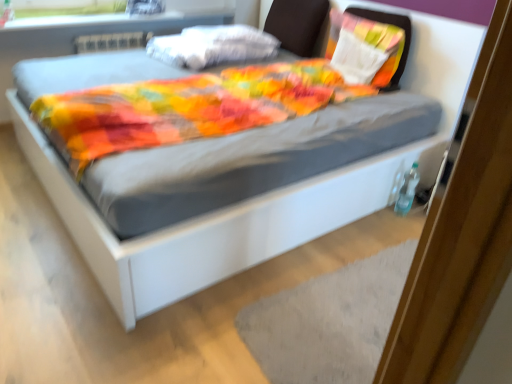
This screenshot has height=384, width=512. Identify the location of matte plastic window sill at upper left. (125, 21).

Image resolution: width=512 pixels, height=384 pixels. I want to click on white cotton pillow at upper center, which ranks as the second pillow in right-to-left order, so click(212, 46).

You are a GUI agent. You are given a task and a screenshot of the screen. Output one action in this format:
    pyautogui.click(x=<x>, y=<y>)
    Task: Click on the textured fabric pillow at upper right, marked as the second pillow in a left-to-right arrangement
    
    Given the screenshot: What is the action you would take?
    pyautogui.click(x=370, y=41)

Considering the positions of points (196, 44) and (315, 38), is point (196, 44) farther from camera compared to point (315, 38)?

No, it is in front of (315, 38).

Considering the sizes of white cotton pillow at upper center, which is the first pillow in left-to-right order, and brown fabric headboard at upper center in the image, is white cotton pillow at upper center, which is the first pillow in left-to-right order, taller or shorter than brown fabric headboard at upper center?

Considering their sizes, white cotton pillow at upper center, which is the first pillow in left-to-right order, has less height than brown fabric headboard at upper center.

Is white cotton pillow at upper center, which is the first pillow in left-to-right order, inside or outside of brown fabric headboard at upper center?

white cotton pillow at upper center, which is the first pillow in left-to-right order, is spatially situated outside brown fabric headboard at upper center.

Considering the positions of objects white cotton pillow at upper center, which ranks as the second pillow in right-to-left order, and matte plastic window sill at upper left in the image provided, who is more to the left, white cotton pillow at upper center, which ranks as the second pillow in right-to-left order, or matte plastic window sill at upper left?

From the viewer's perspective, matte plastic window sill at upper left appears more on the left side.

Considering the sizes of white cotton pillow at upper center, which ranks as the second pillow in right-to-left order, and matte plastic window sill at upper left in the image, is white cotton pillow at upper center, which ranks as the second pillow in right-to-left order, taller or shorter than matte plastic window sill at upper left?

In the image, white cotton pillow at upper center, which ranks as the second pillow in right-to-left order, appears to be taller than matte plastic window sill at upper left.

Consider the image. Which is farther, (181, 42) or (134, 19)?

Point (134, 19)

Can we say white cotton pillow at upper center, which is the first pillow in left-to-right order, lies outside matte plastic window sill at upper left?

white cotton pillow at upper center, which is the first pillow in left-to-right order, lies outside matte plastic window sill at upper left's area.

Is brown fabric headboard at upper center wider than textured fabric pillow at upper right, marked as the second pillow in a left-to-right arrangement?

In fact, brown fabric headboard at upper center might be narrower than textured fabric pillow at upper right, marked as the second pillow in a left-to-right arrangement.

From a real-world perspective, who is located higher, brown fabric headboard at upper center or textured fabric pillow at upper right, arranged as the 1th pillow when viewed from the right?

textured fabric pillow at upper right, arranged as the 1th pillow when viewed from the right.

From the image's perspective, which object appears higher, brown fabric headboard at upper center or textured fabric pillow at upper right, arranged as the 1th pillow when viewed from the right?

brown fabric headboard at upper center.

Is brown fabric headboard at upper center facing towards matte plastic window sill at upper left?

No.

From a real-world perspective, is brown fabric headboard at upper center above or below matte plastic window sill at upper left?

From a real-world perspective, brown fabric headboard at upper center is physically below matte plastic window sill at upper left.

Can you confirm if brown fabric headboard at upper center is taller than matte plastic window sill at upper left?

Yes, brown fabric headboard at upper center is taller than matte plastic window sill at upper left.

Is matte plastic window sill at upper left thinner than gray textured mat at lower center?

Correct, the width of matte plastic window sill at upper left is less than that of gray textured mat at lower center.

From a real-world perspective, which is physically above, matte plastic window sill at upper left or gray textured mat at lower center?

matte plastic window sill at upper left, from a real-world perspective.

In the image, is matte plastic window sill at upper left on the left side or the right side of gray textured mat at lower center?

Clearly, matte plastic window sill at upper left is on the left of gray textured mat at lower center in the image.

Considering the sizes of objects brown fabric headboard at upper center and white cotton pillow at upper center, which ranks as the second pillow in right-to-left order, in the image provided, who is wider, brown fabric headboard at upper center or white cotton pillow at upper center, which ranks as the second pillow in right-to-left order,?

Wider between the two is white cotton pillow at upper center, which ranks as the second pillow in right-to-left order.

Looking at this image, from a real-world perspective, is brown fabric headboard at upper center positioned under white cotton pillow at upper center, which is the first pillow in left-to-right order, based on gravity?

No, from a real-world perspective, brown fabric headboard at upper center is not below white cotton pillow at upper center, which is the first pillow in left-to-right order.

Does point (315, 31) come behind point (187, 43)?

Yes, point (315, 31) is behind point (187, 43).

What's the angular difference between brown fabric headboard at upper center and white cotton pillow at upper center, which is the first pillow in left-to-right order,'s facing directions?

There is a 1.48-degree angle between the facing directions of brown fabric headboard at upper center and white cotton pillow at upper center, which is the first pillow in left-to-right order.

Can you confirm if textured fabric pillow at upper right, arranged as the 1th pillow when viewed from the right, is taller than gray textured mat at lower center?

Yes.

From the image's perspective, which one is positioned higher, textured fabric pillow at upper right, arranged as the 1th pillow when viewed from the right, or gray textured mat at lower center?

textured fabric pillow at upper right, arranged as the 1th pillow when viewed from the right, is shown above in the image.

Relative to gray textured mat at lower center, is textured fabric pillow at upper right, arranged as the 1th pillow when viewed from the right, in front or behind?

textured fabric pillow at upper right, arranged as the 1th pillow when viewed from the right, is positioned farther from the viewer than gray textured mat at lower center.

Between point (395, 64) and point (244, 336), which one is positioned behind?

The point (395, 64) is behind.

Find the location of a particular element. pillow below the brown fabric headboard at upper center (from a real-world perspective) is located at coordinates (212, 46).

Find the location of a particular element. This screenshot has height=384, width=512. window sill on the left of the white cotton pillow at upper center, which ranks as the second pillow in right-to-left order is located at coordinates (125, 21).

Estimate the real-world distances between objects in this image. Which object is closer to matte plastic window sill at upper left, brown fabric headboard at upper center or textured fabric pillow at upper right, marked as the second pillow in a left-to-right arrangement?

Based on the image, brown fabric headboard at upper center appears to be nearer to matte plastic window sill at upper left.

Estimate the real-world distances between objects in this image. Which object is closer to gray textured mat at lower center, matte plastic window sill at upper left or textured fabric pillow at upper right, arranged as the 1th pillow when viewed from the right?

Based on the image, textured fabric pillow at upper right, arranged as the 1th pillow when viewed from the right, appears to be nearer to gray textured mat at lower center.

When comparing their distances from gray textured mat at lower center, does white cotton pillow at upper center, which ranks as the second pillow in right-to-left order, or textured fabric pillow at upper right, marked as the second pillow in a left-to-right arrangement, seem further?

white cotton pillow at upper center, which ranks as the second pillow in right-to-left order.

Looking at the image, which one is located further to brown fabric headboard at upper center, textured fabric pillow at upper right, marked as the second pillow in a left-to-right arrangement, or white cotton pillow at upper center, which is the first pillow in left-to-right order?

textured fabric pillow at upper right, marked as the second pillow in a left-to-right arrangement, lies further to brown fabric headboard at upper center than the other object.

Based on their spatial positions, is brown fabric headboard at upper center or textured fabric pillow at upper right, marked as the second pillow in a left-to-right arrangement, closer to gray textured mat at lower center?

Based on the image, textured fabric pillow at upper right, marked as the second pillow in a left-to-right arrangement, appears to be nearer to gray textured mat at lower center.

When comparing their distances from gray textured mat at lower center, does textured fabric pillow at upper right, marked as the second pillow in a left-to-right arrangement, or brown fabric headboard at upper center seem closer?

textured fabric pillow at upper right, marked as the second pillow in a left-to-right arrangement, is positioned closer to the anchor gray textured mat at lower center.

From the picture: Estimate the real-world distances between objects in this image. Which object is closer to gray textured mat at lower center, matte plastic window sill at upper left or brown fabric headboard at upper center?

brown fabric headboard at upper center.

Estimate the real-world distances between objects in this image. Which object is closer to white cotton pillow at upper center, which ranks as the second pillow in right-to-left order, brown fabric headboard at upper center or matte plastic window sill at upper left?

Among the two, brown fabric headboard at upper center is located nearer to white cotton pillow at upper center, which ranks as the second pillow in right-to-left order.

In order to click on headboard situated between white cotton pillow at upper center, which ranks as the second pillow in right-to-left order, and textured fabric pillow at upper right, arranged as the 1th pillow when viewed from the right, from left to right in this screenshot , I will do `click(298, 25)`.

The image size is (512, 384). Find the location of `pillow between matte plastic window sill at upper left and brown fabric headboard at upper center in the horizontal direction`. pillow between matte plastic window sill at upper left and brown fabric headboard at upper center in the horizontal direction is located at coordinates point(212,46).

Where is `headboard between matte plastic window sill at upper left and gray textured mat at lower center from top to bottom`? The height and width of the screenshot is (384, 512). headboard between matte plastic window sill at upper left and gray textured mat at lower center from top to bottom is located at coordinates (298, 25).

Locate an element on the screen. This screenshot has height=384, width=512. headboard between matte plastic window sill at upper left and textured fabric pillow at upper right, arranged as the 1th pillow when viewed from the right, from left to right is located at coordinates (298, 25).